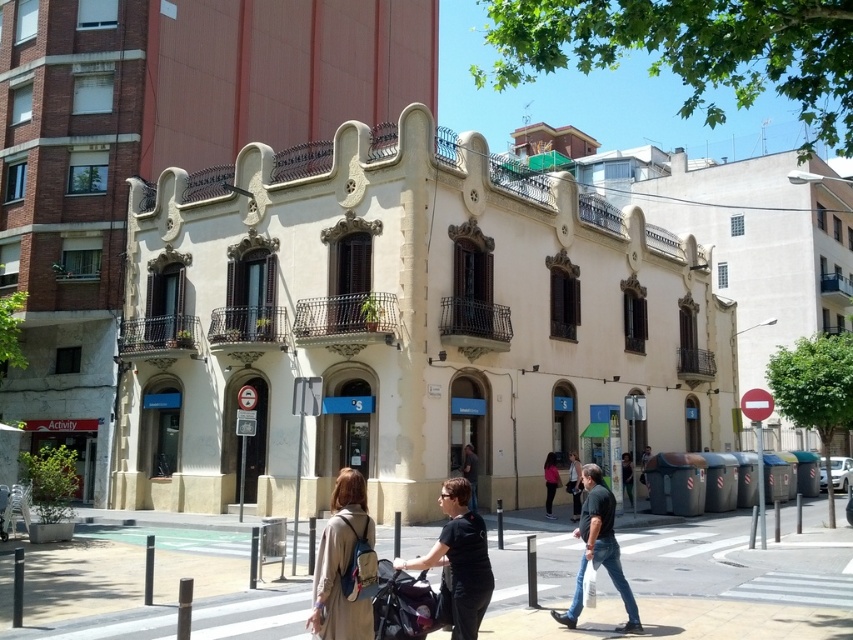
In the scene shown: You are a delivery person trying to navigate through the street. You need to place a large package on the concrete pavement at lower center without blocking the dark gray fabric baby carriage at center. Is there enough space?

The concrete pavement at lower center is bigger than the dark gray fabric baby carriage at center, so there is enough space to place the large package on the concrete pavement at lower center without blocking the baby carriage.

You are standing on the sidewalk and see the concrete pavement at lower center and the dark gray fabric baby carriage at center. Which object is closer to you?

The dark gray fabric baby carriage at center is closer to you because the concrete pavement at lower center is further away.

You are a pedestrian standing on the sidewalk and see a beige fabric coat at center and a matte black jacket at center. Which clothing item is positioned higher relative to the other?

The beige fabric coat at center is located above the matte black jacket at center, so it is positioned higher.